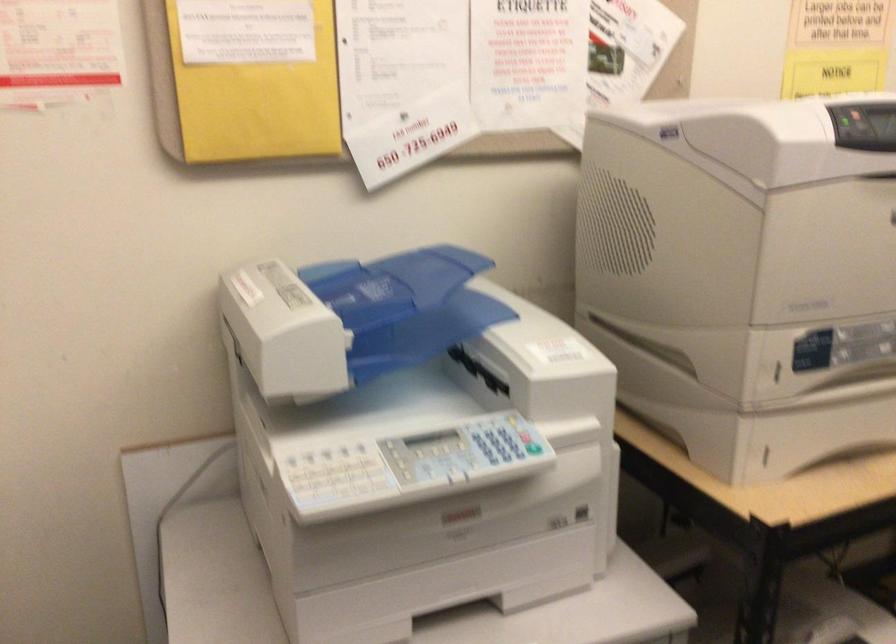
What do you see at coordinates (495, 444) in the screenshot?
I see `the printer keypad buttons` at bounding box center [495, 444].